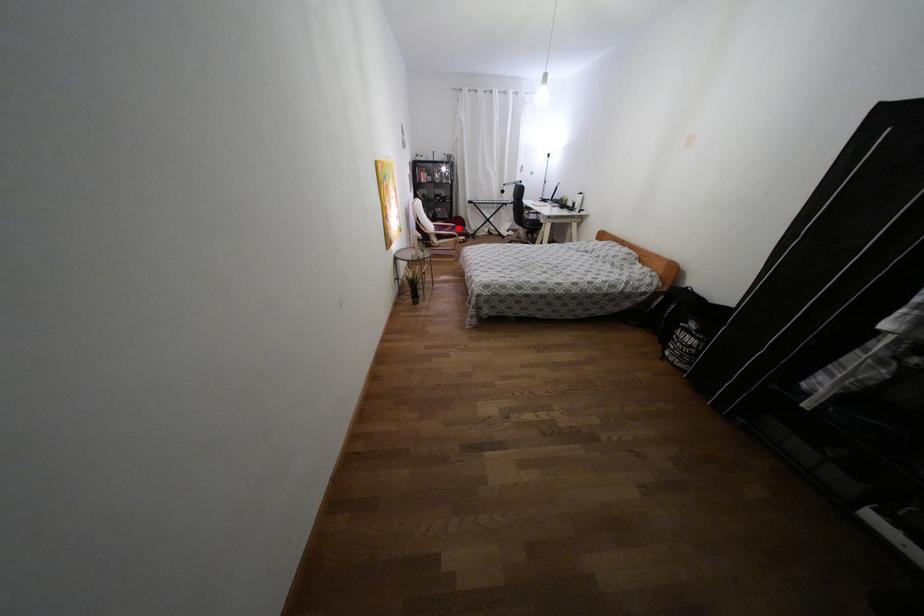
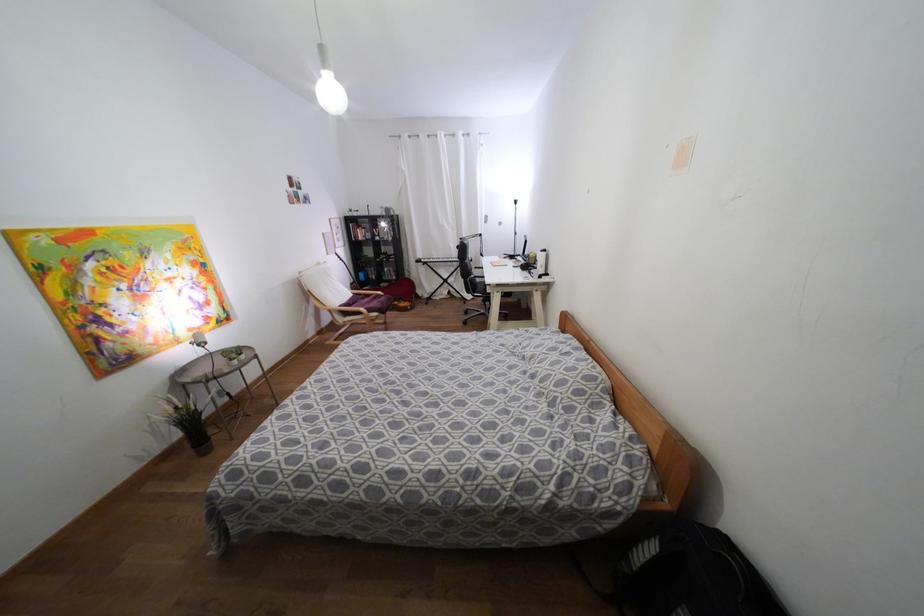
Locate, in the second image, the point that corresponds to the highlighted location in the first image.

(382, 299)